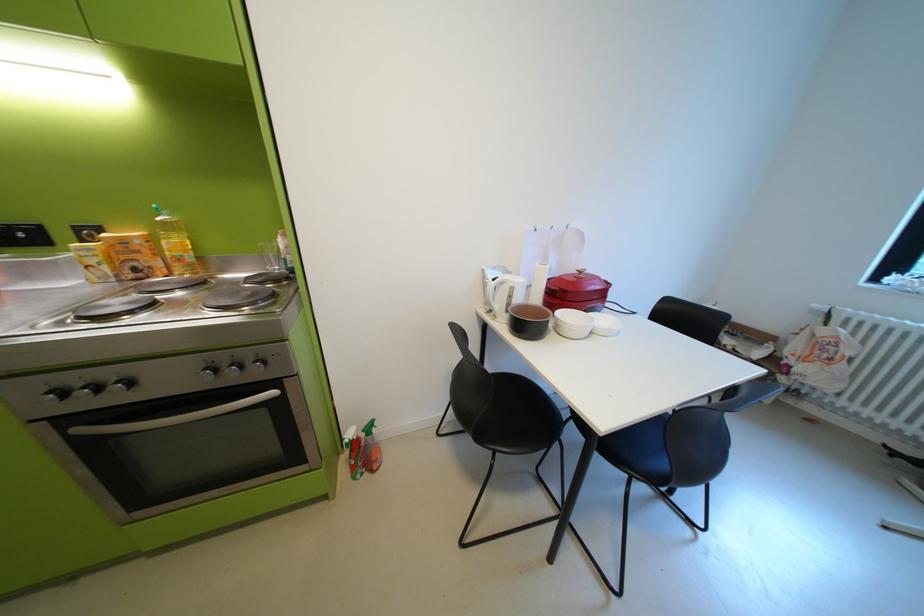
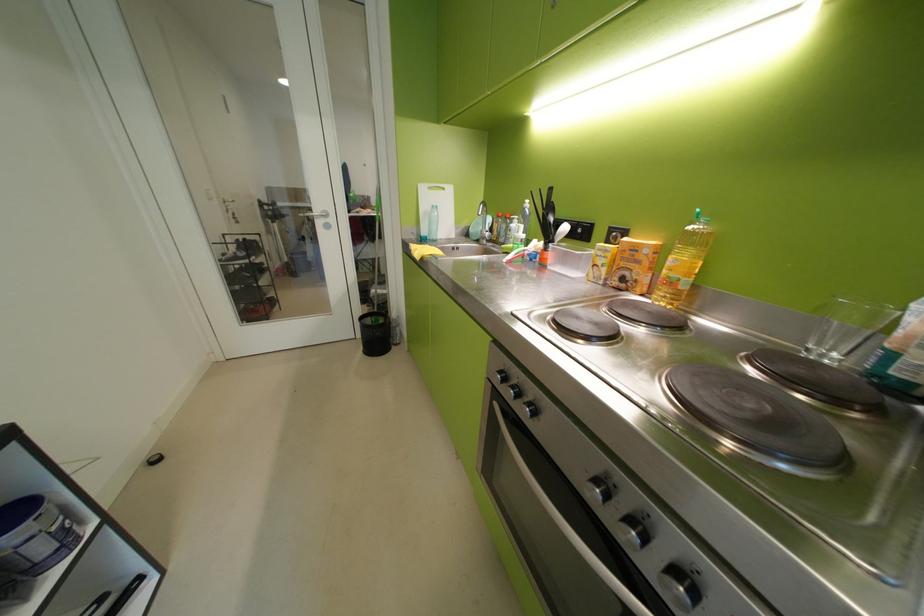
The point at [189,261] is marked in the first image. Where is the corresponding point in the second image?

(681, 284)